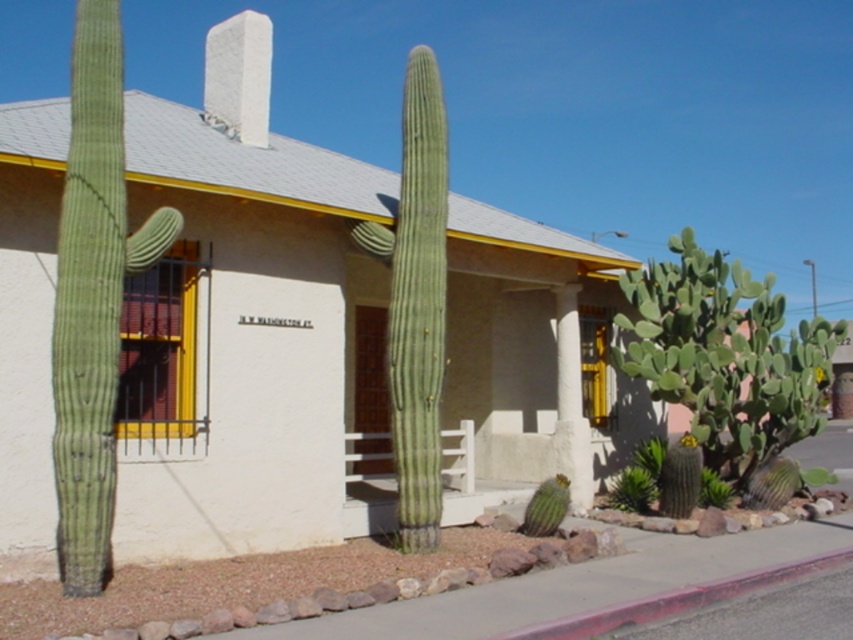
Who is shorter, green rough textured cactus at left or green matte cactus at center?

green rough textured cactus at left

Is green rough textured cactus at left to the right of green matte cactus at center from the viewer's perspective?

Incorrect, green rough textured cactus at left is not on the right side of green matte cactus at center.

Which is in front, point (61, 314) or point (440, 92)?

Point (61, 314) is in front.

This screenshot has height=640, width=853. I want to click on green rough textured cactus at left, so click(93, 298).